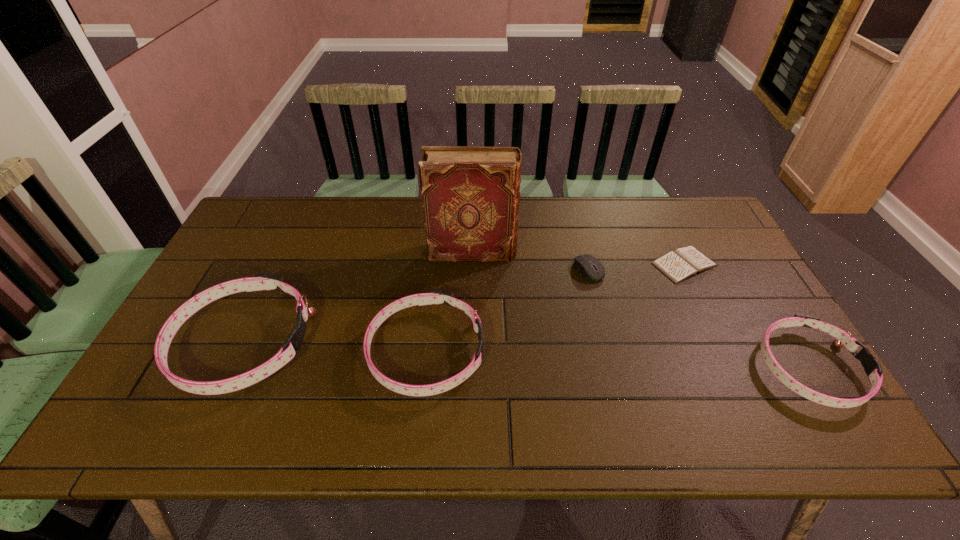
Locate an element on the screen. Image resolution: width=960 pixels, height=540 pixels. vacant space that satisfies the following two spatial constraints: 1. on the spine side of the fourth object from left to right; 2. on the right side of the tallest object is located at coordinates (472, 269).

Where is `free space that satisfies the following two spatial constraints: 1. on the spine side of the fifth tallest object; 2. on the left side of the hardback book`? free space that satisfies the following two spatial constraints: 1. on the spine side of the fifth tallest object; 2. on the left side of the hardback book is located at coordinates (472, 269).